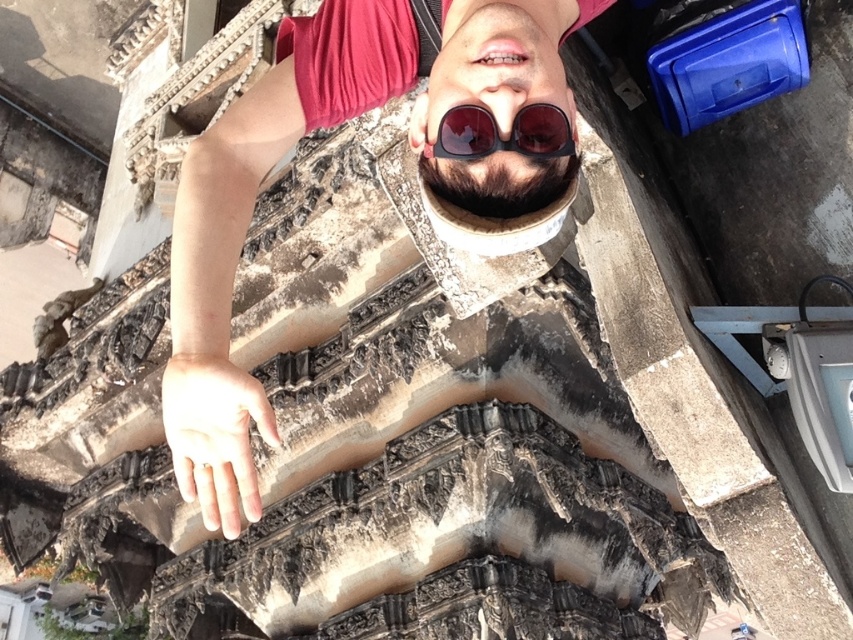
This screenshot has width=853, height=640. What are the coordinates of `matte black sunglasses at center` in the screenshot? It's located at (293, 144).

Find the location of a particular element. This screenshot has height=640, width=853. matte black sunglasses at center is located at coordinates (293, 144).